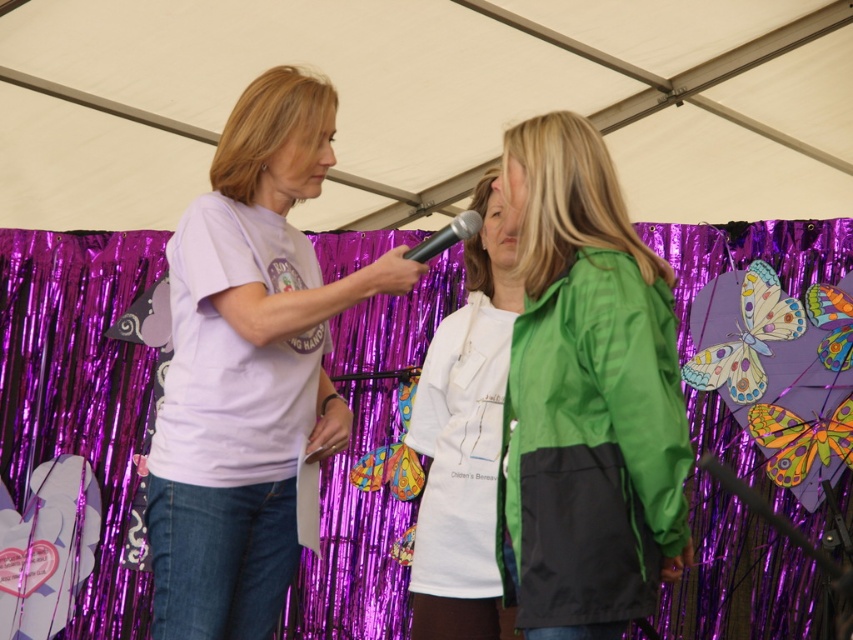
Is white matte shirt at center to the left of black matte microphone at center from the viewer's perspective?

No, white matte shirt at center is not to the left of black matte microphone at center.

Between white matte shirt at center and black matte microphone at center, which one appears on the right side from the viewer's perspective?

From the viewer's perspective, white matte shirt at center appears more on the right side.

The image size is (853, 640). Describe the element at coordinates (465, 442) in the screenshot. I see `white matte shirt at center` at that location.

Find the location of a particular element. Image resolution: width=853 pixels, height=640 pixels. white matte shirt at center is located at coordinates (465, 442).

Does matte white t-shirt at center lie in front of black matte microphone at center?

Yes.

Who is higher up, matte white t-shirt at center or black matte microphone at center?

black matte microphone at center is higher up.

Is point (219, 179) positioned before point (457, 225)?

No, (219, 179) is behind (457, 225).

At what (x,y) coordinates should I click in order to perform the action: click on matte white t-shirt at center. Please return your answer as a coordinate pair (x, y). Looking at the image, I should click on 248,368.

Find the location of a particular element. matte white t-shirt at center is located at coordinates (248, 368).

Which is more to the right, matte white t-shirt at center or white matte shirt at center?

From the viewer's perspective, white matte shirt at center appears more on the right side.

The height and width of the screenshot is (640, 853). What do you see at coordinates (248, 368) in the screenshot? I see `matte white t-shirt at center` at bounding box center [248, 368].

The width and height of the screenshot is (853, 640). Identify the location of matte white t-shirt at center. (248, 368).